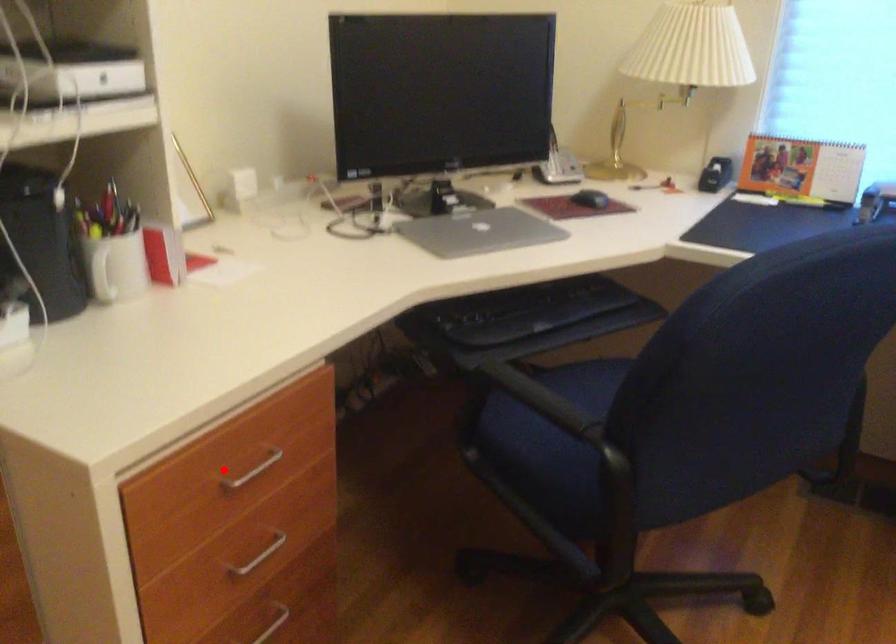
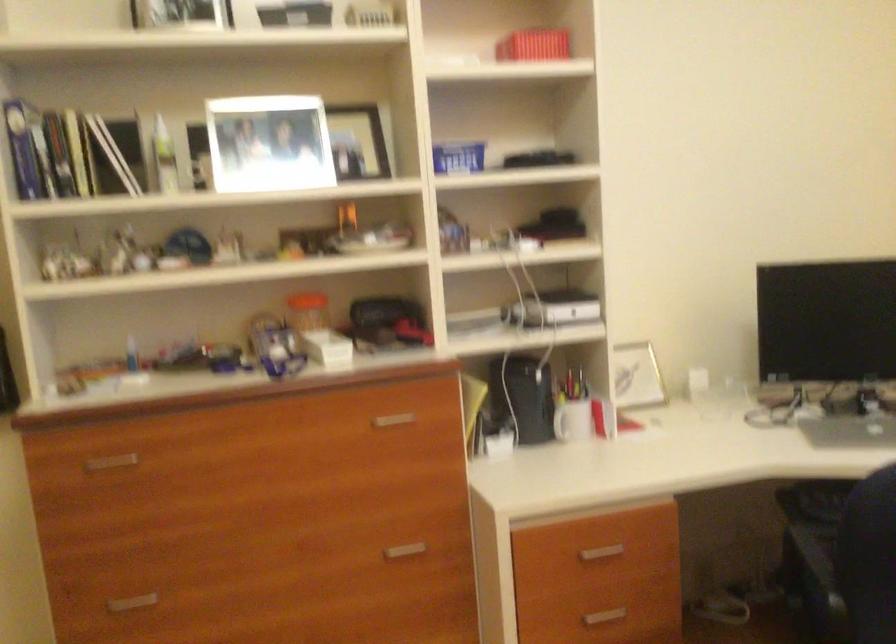
The point at the highlighted location is marked in the first image. Where is the corresponding point in the second image?

(600, 553)